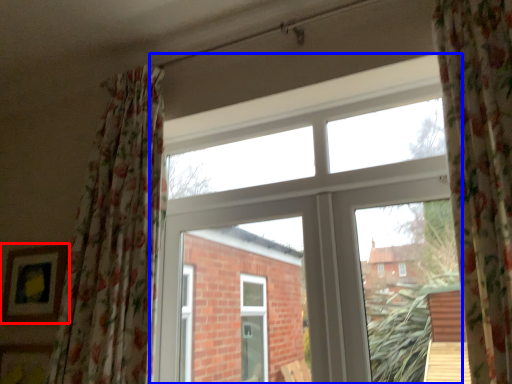
Question: Which object is closer to the camera taking this photo, picture frame (highlighted by a red box) or window (highlighted by a blue box)?

Choices:
 (A) picture frame
 (B) window

Answer: (B)